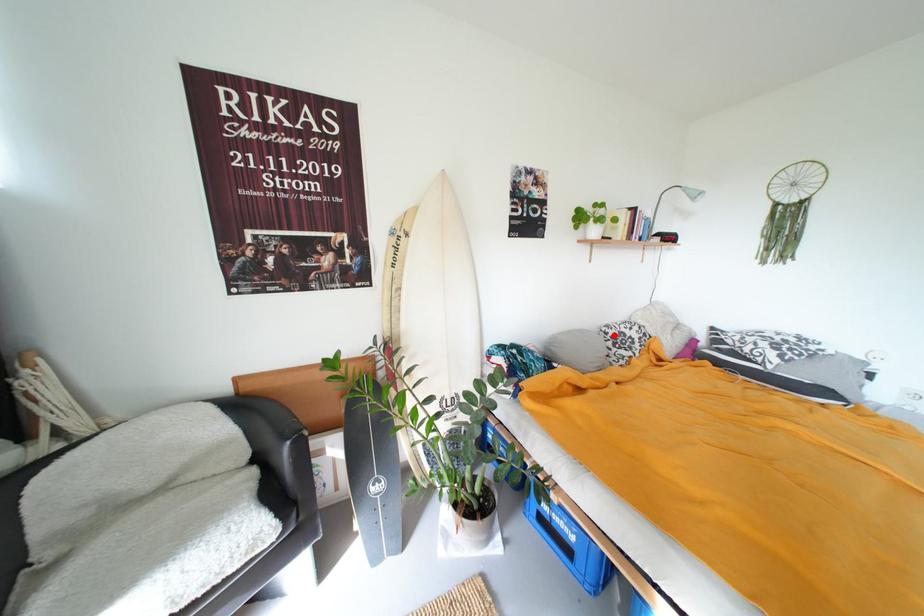
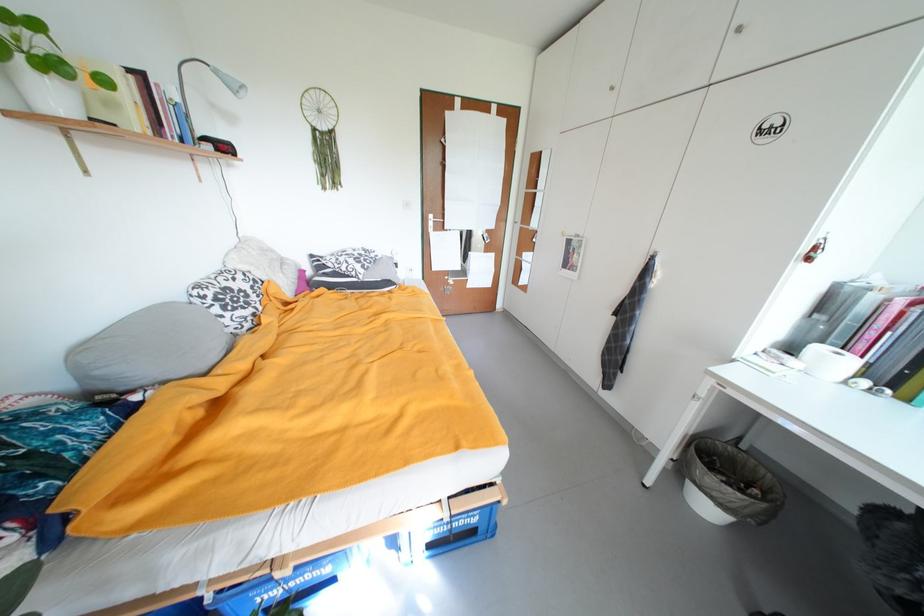
Question: I am providing you with two images of the same scene from different viewpoints. In image1, a red point is highlighted. Considering the same 3D point in image2, which of the following is correct?

Choices:
 (A) It is closer
 (B) It is farther

Answer: (A)